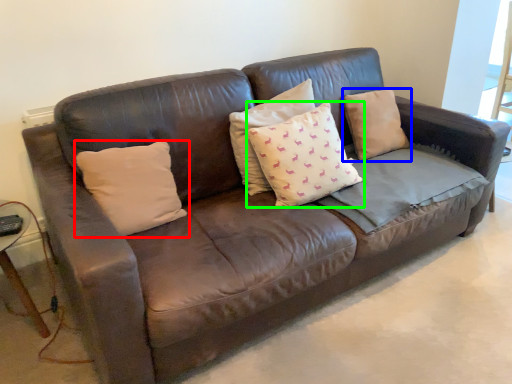
Question: Which object is positioned farthest from pillow (highlighted by a red box)? Select from pillow (highlighted by a blue box) and pillow (highlighted by a green box).

Choices:
 (A) pillow
 (B) pillow

Answer: (A)